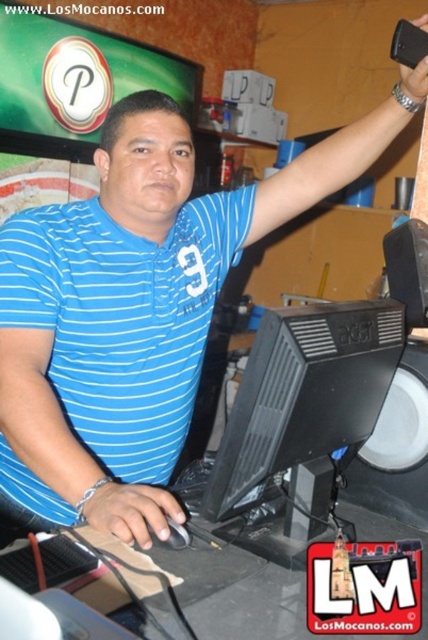
Question: Among these points, which one is nearest to the camera?

Choices:
 (A) (391, 344)
 (B) (222, 209)
 (C) (404, 76)
 (D) (88, 520)

Answer: (D)

Question: Which of the following is the closest to the observer?

Choices:
 (A) (374, 385)
 (B) (106, 262)

Answer: (A)

Question: Which object appears farthest from the camera in this image?

Choices:
 (A) black plastic monitor at center
 (B) matte black phone at upper right

Answer: (B)

Question: Is matte black mouse at lower center thinner than matte black phone at upper right?

Choices:
 (A) no
 (B) yes

Answer: (A)

Question: From the image, what is the correct spatial relationship of black plastic monitor at center in relation to matte black mouse at lower center?

Choices:
 (A) right
 (B) left

Answer: (A)

Question: Does matte black mouse at lower center appear on the left side of matte black phone at upper right?

Choices:
 (A) no
 (B) yes

Answer: (B)